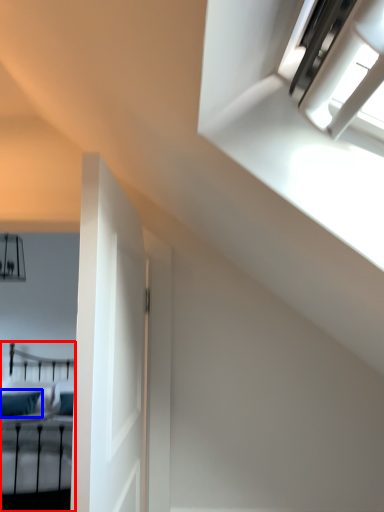
Question: Which of the following is the farthest to the observer, bed (highlighted by a red box) or pillow (highlighted by a blue box)?

Choices:
 (A) bed
 (B) pillow

Answer: (B)